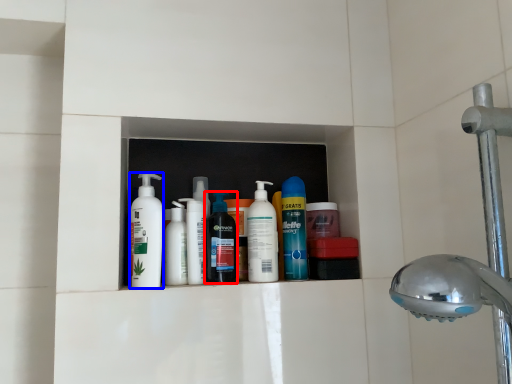
Question: Which of the following is the closest to the observer, cleaning product (highlighted by a red box) or cleaning product (highlighted by a blue box)?

Choices:
 (A) cleaning product
 (B) cleaning product

Answer: (B)